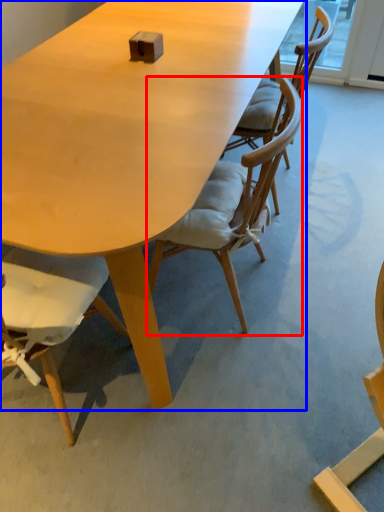
Question: Which object appears closest to the camera in this image, chair (highlighted by a red box) or table (highlighted by a blue box)?

Choices:
 (A) chair
 (B) table

Answer: (B)